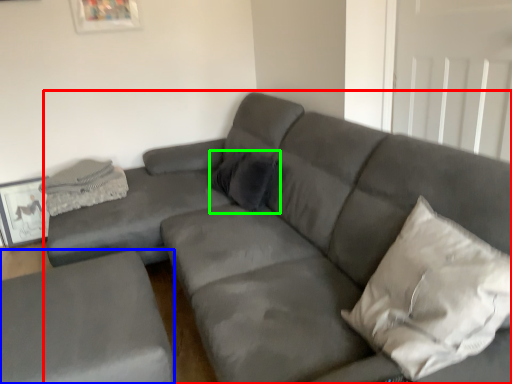
Question: Which object is positioned closest to studio couch (highlighted by a red box)? Select from studio couch (highlighted by a blue box) and pillow (highlighted by a green box).

Choices:
 (A) studio couch
 (B) pillow

Answer: (B)